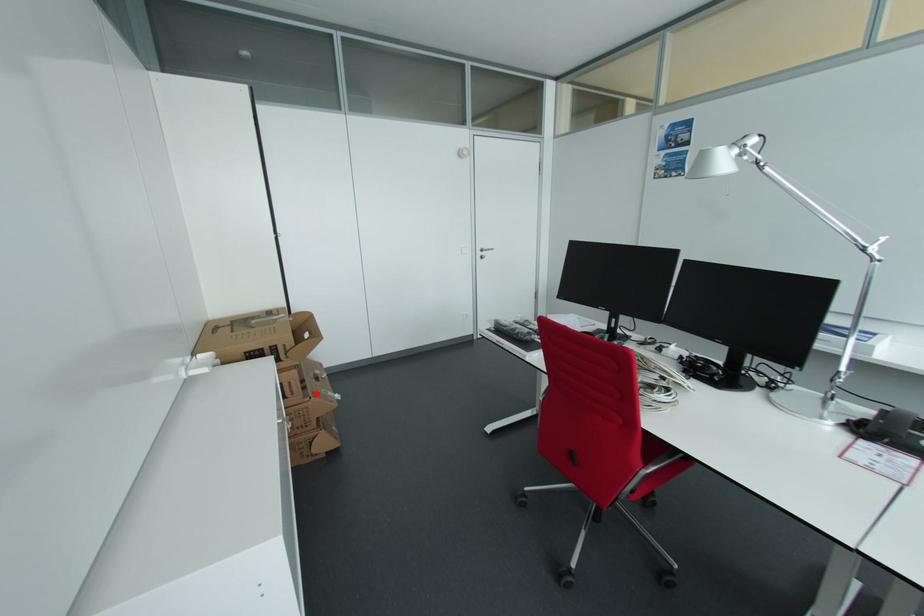
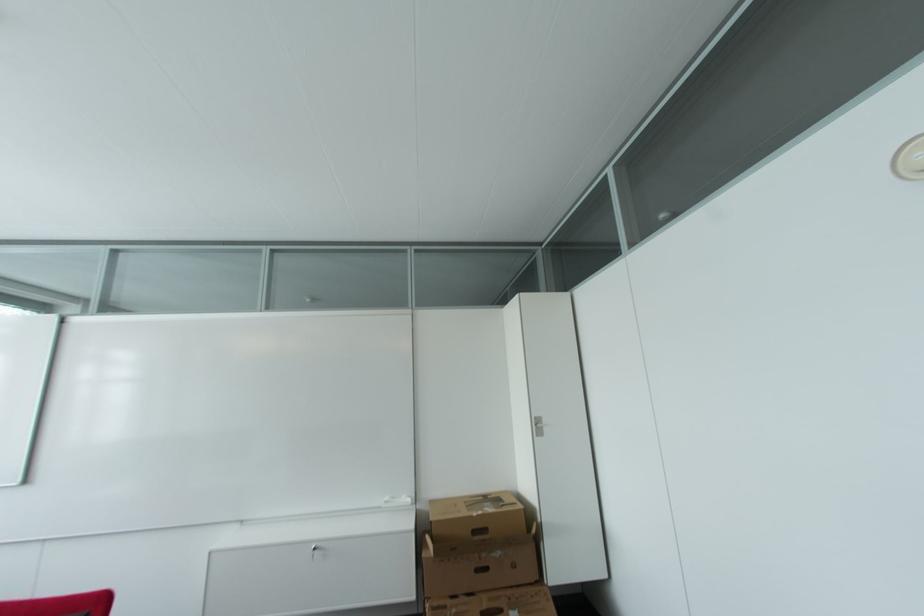
Question: A red point is marked in image1. In image2, is the corresponding 3D point closer to the camera or farther? Reply with the corresponding letter.

Choices:
 (A) The corresponding 3D point is closer.
 (B) The corresponding 3D point is farther.

Answer: (B)